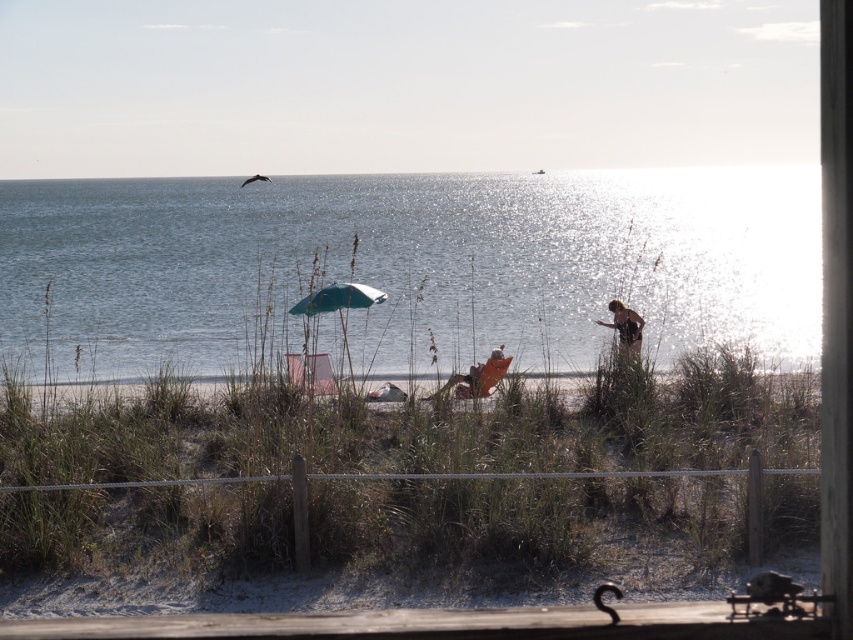
Question: Does light brown sand at center have a greater width compared to brown textured shirt at right?

Choices:
 (A) no
 (B) yes

Answer: (B)

Question: Can you confirm if teal fabric umbrella at center is smaller than brown textured shirt at right?

Choices:
 (A) no
 (B) yes

Answer: (A)

Question: Which object appears farthest from the camera in this image?

Choices:
 (A) teal fabric umbrella at center
 (B) glistening blue water at center

Answer: (B)

Question: Among these points, which one is nearest to the camera?

Choices:
 (A) coord(424,227)
 (B) coord(363,294)

Answer: (B)

Question: Which object is closer to the camera taking this photo?

Choices:
 (A) glistening blue water at center
 (B) teal fabric umbrella at center
 (C) light brown sand at center

Answer: (C)

Question: Does light brown sand at center lie in front of glistening blue water at center?

Choices:
 (A) no
 (B) yes

Answer: (B)